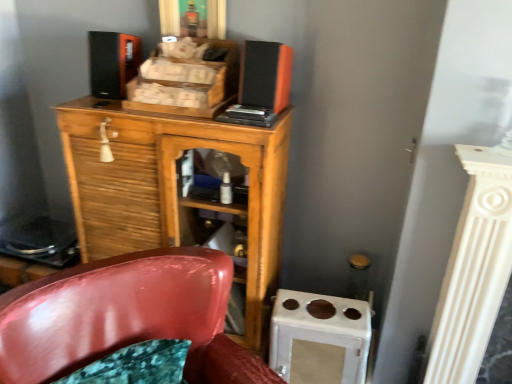
Question: Does glossy plastic chair at lower left come behind wooden cabinet at center?

Choices:
 (A) yes
 (B) no

Answer: (B)

Question: Considering the relative sizes of glossy plastic chair at lower left and wooden cabinet at center in the image provided, is glossy plastic chair at lower left bigger than wooden cabinet at center?

Choices:
 (A) yes
 (B) no

Answer: (A)

Question: From a real-world perspective, is glossy plastic chair at lower left located beneath wooden cabinet at center?

Choices:
 (A) no
 (B) yes

Answer: (B)

Question: Considering the relative sizes of glossy plastic chair at lower left and wooden cabinet at center in the image provided, is glossy plastic chair at lower left shorter than wooden cabinet at center?

Choices:
 (A) no
 (B) yes

Answer: (B)

Question: From a real-world perspective, is glossy plastic chair at lower left over wooden cabinet at center?

Choices:
 (A) no
 (B) yes

Answer: (A)

Question: Visually, is glossy plastic chair at lower left positioned to the left or to the right of wooden cabinet at center?

Choices:
 (A) left
 (B) right

Answer: (B)

Question: In terms of height, does glossy plastic chair at lower left look taller or shorter compared to wooden cabinet at center?

Choices:
 (A) tall
 (B) short

Answer: (B)

Question: From a real-world perspective, is glossy plastic chair at lower left positioned above or below wooden cabinet at center?

Choices:
 (A) below
 (B) above

Answer: (A)

Question: Looking at the image, does glossy plastic chair at lower left seem bigger or smaller compared to wooden cabinet at center?

Choices:
 (A) small
 (B) big

Answer: (B)

Question: Is wooden cabinet at center spatially inside glossy plastic chair at lower left, or outside of it?

Choices:
 (A) outside
 (B) inside

Answer: (A)

Question: Considering their positions, is wooden cabinet at center located in front of or behind glossy plastic chair at lower left?

Choices:
 (A) front
 (B) behind

Answer: (B)

Question: From their relative heights in the image, would you say wooden cabinet at center is taller or shorter than glossy plastic chair at lower left?

Choices:
 (A) tall
 (B) short

Answer: (A)

Question: Considering the positions of point (84, 230) and point (130, 319), is point (84, 230) closer or farther from the camera than point (130, 319)?

Choices:
 (A) closer
 (B) farther

Answer: (B)

Question: Is point (36, 345) closer or farther from the camera than point (122, 36)?

Choices:
 (A) farther
 (B) closer

Answer: (B)

Question: Is glossy plastic chair at lower left wider or thinner than matte black speaker at upper left, the second speaker positioned from the right?

Choices:
 (A) thin
 (B) wide

Answer: (B)